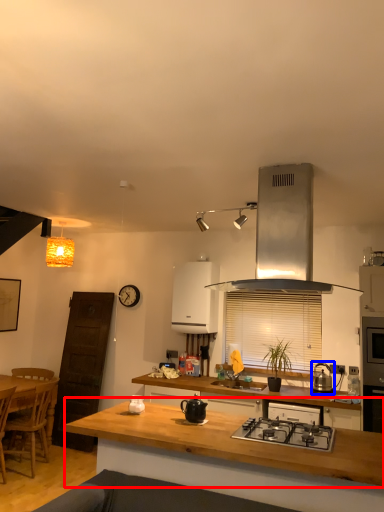
Question: Among these objects, which one is farthest to the camera, countertop (highlighted by a red box) or kitchen appliance (highlighted by a blue box)?

Choices:
 (A) countertop
 (B) kitchen appliance

Answer: (B)